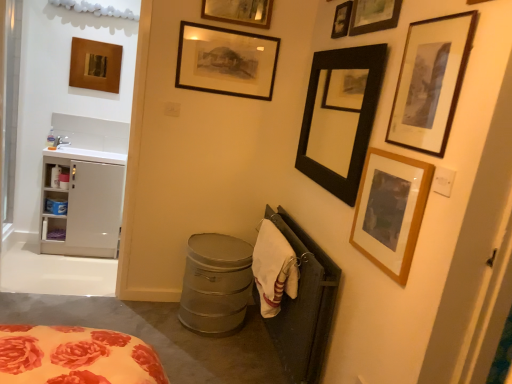
At what (x,y) coordinates should I click in order to perform the action: click on free space in front of metallic gray trash can at lower center. Please return your answer as a coordinate pair (x, y). Image resolution: width=512 pixels, height=384 pixels. Looking at the image, I should click on [x=206, y=357].